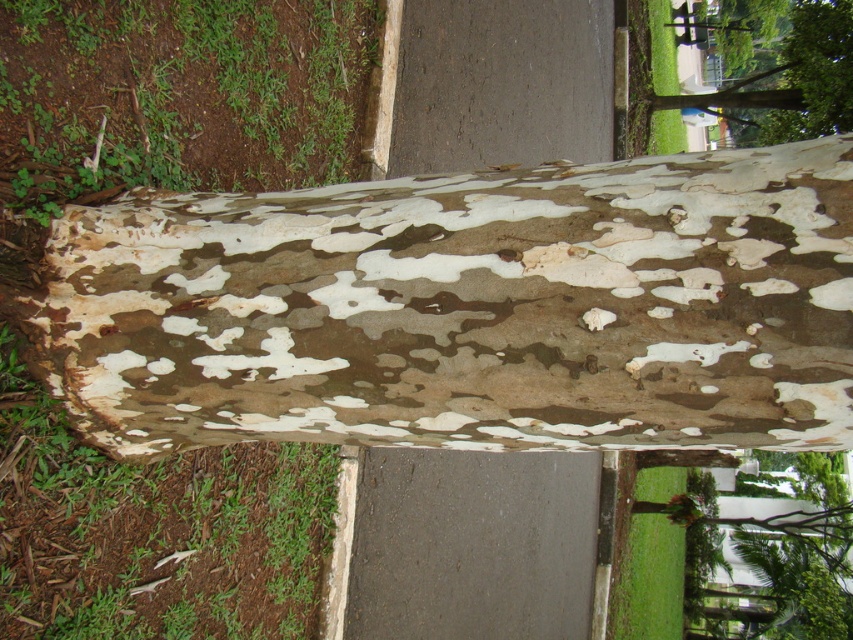
You are an artist trying to sketch the tree trunk in the image. You need to focus on the area marked by the point at coordinates point [467,308]. What kind of texture should you emphasize in that area?

The point [467,308] indicates speckled bark tree trunk at center, so you should emphasize the speckled texture of the bark in that area.

You are a park ranger planning to install a new bench between the speckled bark tree trunk at center and the camouflage bark tree at upper right. The bench requires a minimum of 40 feet of space to accommodate visitors comfortably. Based on the image, do you think the available space between these two trees is sufficient?

The distance between the speckled bark tree trunk at center and the camouflage bark tree at upper right is 37.30 feet, which is less than the required 40 feet. Therefore, the available space is insufficient for the bench.

You are a nature photographer aiming to capture both the speckled bark tree trunk at center and the camouflage bark tree at upper right in a single frame. Given their sizes, which tree trunk should you focus on to ensure both are clearly visible in your photo?

The speckled bark tree trunk at center is smaller than the camouflage bark tree at upper right, so focusing on the smaller speckled bark tree trunk at center will allow both to fit clearly in the frame.